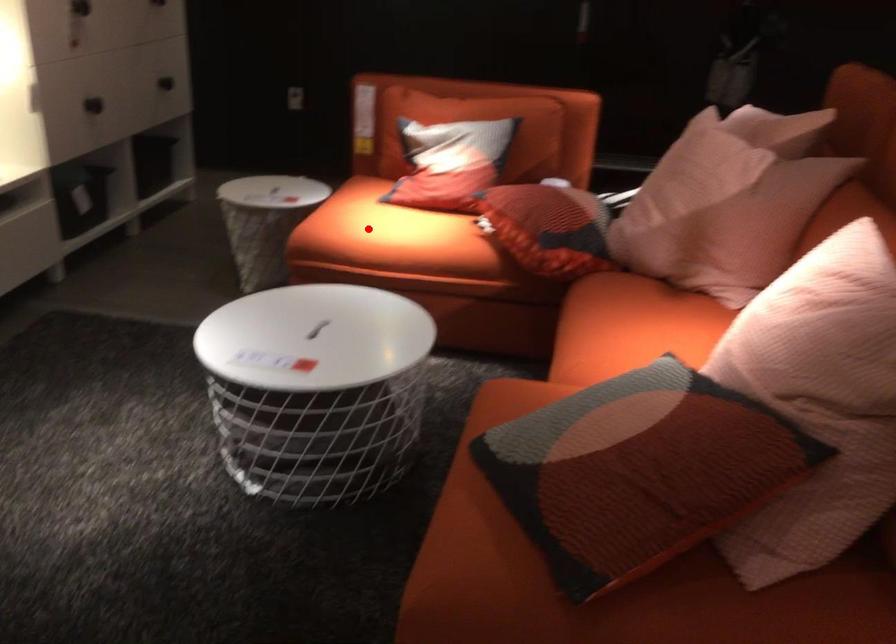
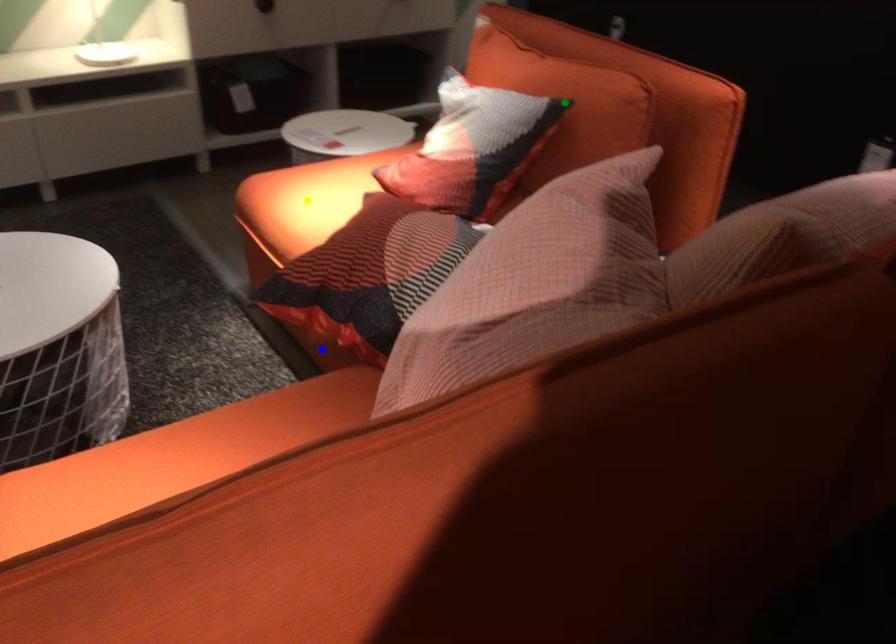
Question: I am providing you with two images of the same scene from different viewpoints. A red point is marked on the first image. You are given multiple points on the second image. Which point in image 2 represents the same 3d spot as the red point in image 1?

Choices:
 (A) yellow point
 (B) green point
 (C) blue point

Answer: (A)